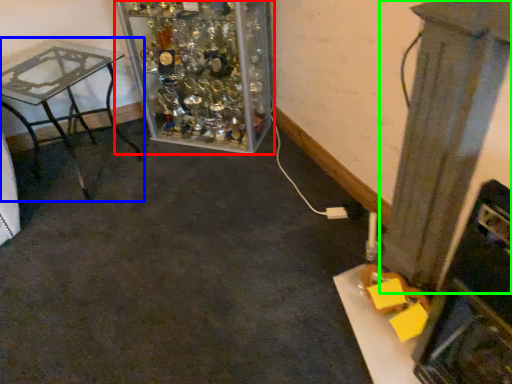
Question: Based on their relative distances, which object is nearer to furniture (highlighted by a red box)? Choose from table (highlighted by a blue box) and pillar (highlighted by a green box).

Choices:
 (A) table
 (B) pillar

Answer: (A)